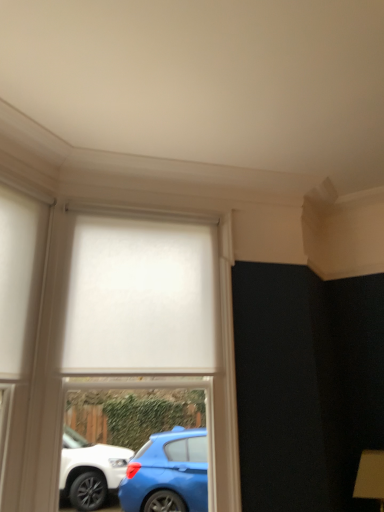
Question: Is white matte roller blind at center inside or outside of white matte curtain at center?

Choices:
 (A) outside
 (B) inside

Answer: (A)

Question: Is white matte roller blind at center wider or thinner than white matte curtain at center?

Choices:
 (A) thin
 (B) wide

Answer: (B)

Question: Estimate the real-world distances between objects in this image. Which object is farther from the white matte curtain at center?

Choices:
 (A) white matte roller blind at center
 (B) white matte glass door at left

Answer: (B)

Question: Estimate the real-world distances between objects in this image. Which object is farther from the white matte curtain at center?

Choices:
 (A) white matte glass door at left
 (B) white matte roller blind at center

Answer: (A)